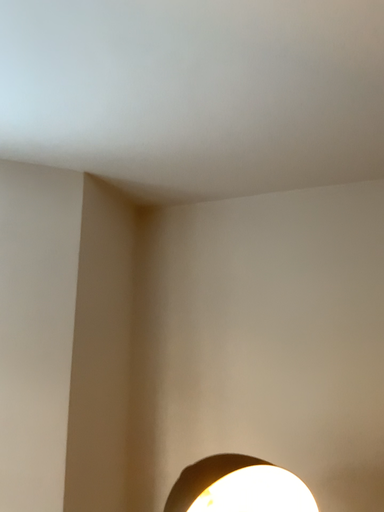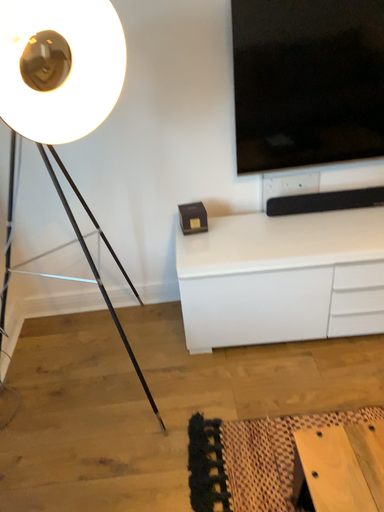
Question: Which way did the camera rotate in the video?

Choices:
 (A) rotated downward
 (B) rotated upward

Answer: (A)